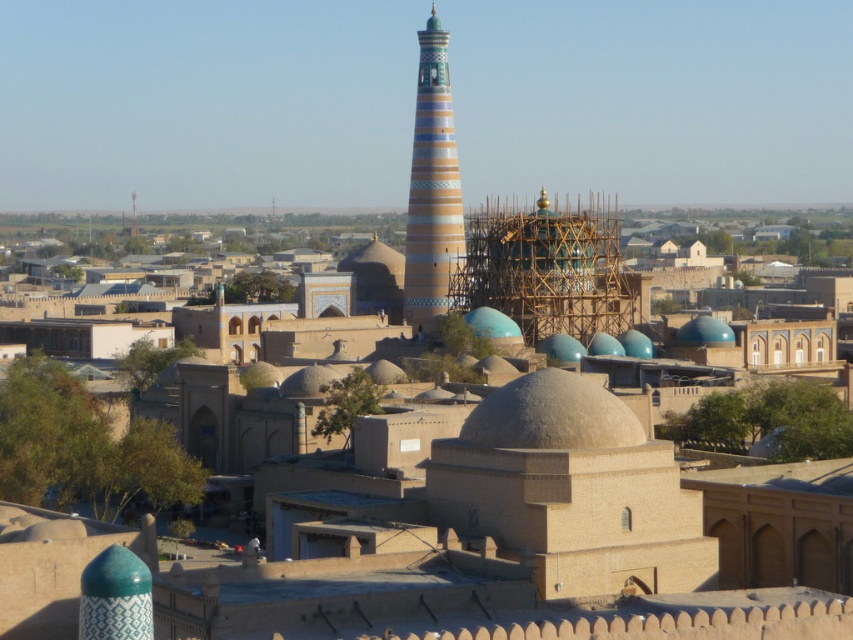
Based on the scene description, where is the multicolored glazed tower at center located in terms of its 2D coordinates?

The multicolored glazed tower at center is located at the 2D coordinates of point (432, 188).

You are a drone operator tasked with capturing aerial footage of the historic cityscape. Your drone has a maximum flight range of 150 meters. If you are positioned at the gray textured dome at center, can you safely fly your drone to the multicolored glazed tower at center without exceeding its range?

The multicolored glazed tower at center is 146.77 meters away from the gray textured dome at center. Since the drone has a maximum range of 150 meters, it can safely fly to the multicolored glazed tower at center without exceeding its limit.

You are standing in a historic Central Asian city and want to take a photo of the multicolored glazed tower at center. If your camera has a maximum zoom range of 200 meters, will you be able to capture the tower clearly without moving closer?

The multicolored glazed tower at center is 272.72 meters away from viewer. Since the camera can only zoom up to 200 meters, you cannot capture the tower clearly without moving closer.